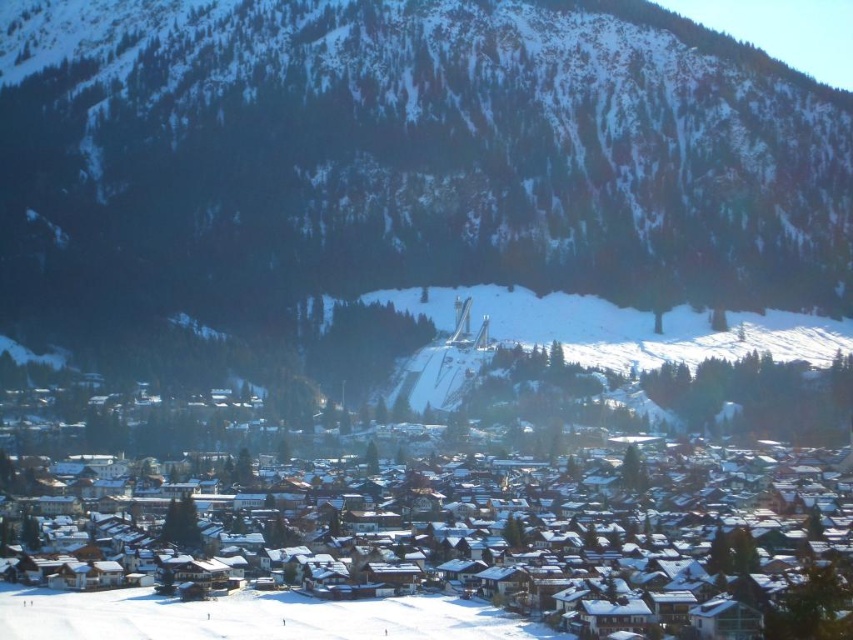
Based on the photo, which of these two, snowy forested mountain at center or white snow-covered houses at center, stands taller?

snowy forested mountain at center is taller.

What do you see at coordinates (407, 156) in the screenshot? I see `snowy forested mountain at center` at bounding box center [407, 156].

You are a GUI agent. You are given a task and a screenshot of the screen. Output one action in this format:
    pyautogui.click(x=<x>, y=<y>)
    Task: Click on the snowy forested mountain at center
    The image size is (853, 640).
    Given the screenshot: What is the action you would take?
    pyautogui.click(x=407, y=156)